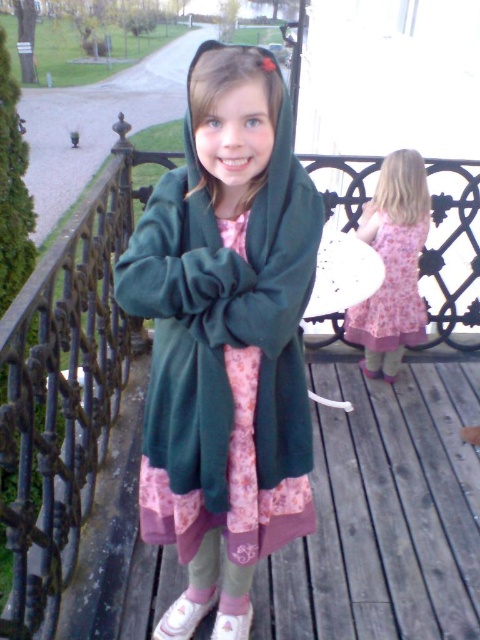
Which is behind, point (255, 292) or point (375, 234)?

Point (375, 234)

Is dark green fleece coat at center closer to the viewer compared to pink floral dress at center?

That is True.

Is point (264, 100) positioned in front of point (376, 317)?

Yes, point (264, 100) is in front of point (376, 317).

Image resolution: width=480 pixels, height=640 pixels. Identify the location of dark green fleece coat at center. (226, 337).